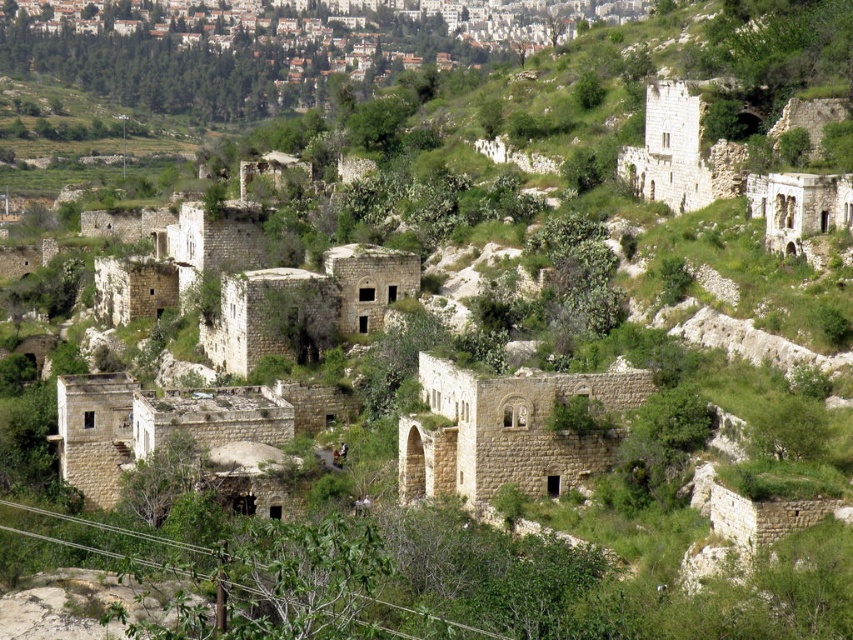
Is stone ruins at upper center to the right of stone archway at upper right from the viewer's perspective?

Incorrect, stone ruins at upper center is not on the right side of stone archway at upper right.

Which is more to the right, stone ruins at upper center or stone archway at upper right?

From the viewer's perspective, stone archway at upper right appears more on the right side.

What do you see at coordinates (282, 28) in the screenshot? I see `stone ruins at upper center` at bounding box center [282, 28].

At what (x,y) coordinates should I click in order to perform the action: click on stone ruins at upper center. Please return your answer as a coordinate pair (x, y). The image size is (853, 640). Looking at the image, I should click on (282, 28).

Is stone ruins at upper center in front of beige stone ruins at center?

No, it is not.

Is stone ruins at upper center further to camera compared to beige stone ruins at center?

Yes, stone ruins at upper center is further from the viewer.

Locate an element on the screen. stone ruins at upper center is located at coordinates (282, 28).

Does beige stone ruins at center have a greater height compared to stone archway at upper right?

Incorrect, beige stone ruins at center's height is not larger of stone archway at upper right's.

In the scene shown: Who is positioned more to the right, beige stone ruins at center or stone archway at upper right?

stone archway at upper right

Locate an element on the screen. beige stone ruins at center is located at coordinates (503, 432).

At what (x,y) coordinates should I click in order to perform the action: click on beige stone ruins at center. Please return your answer as a coordinate pair (x, y). This screenshot has height=640, width=853. Looking at the image, I should click on (503, 432).